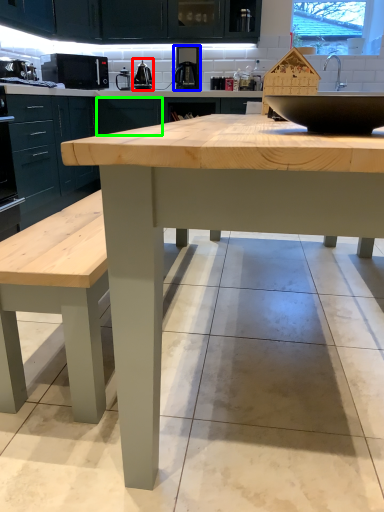
Question: Based on their relative distances, which object is nearer to appliance (highlighted by a red box)? Choose from coffee machine (highlighted by a blue box) and cabinetry (highlighted by a green box).

Choices:
 (A) coffee machine
 (B) cabinetry

Answer: (B)